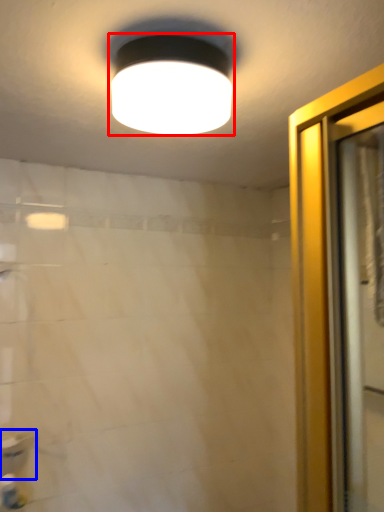
Question: Among these objects, which one is farthest to the camera, lamp (highlighted by a red box) or sink (highlighted by a blue box)?

Choices:
 (A) lamp
 (B) sink

Answer: (B)